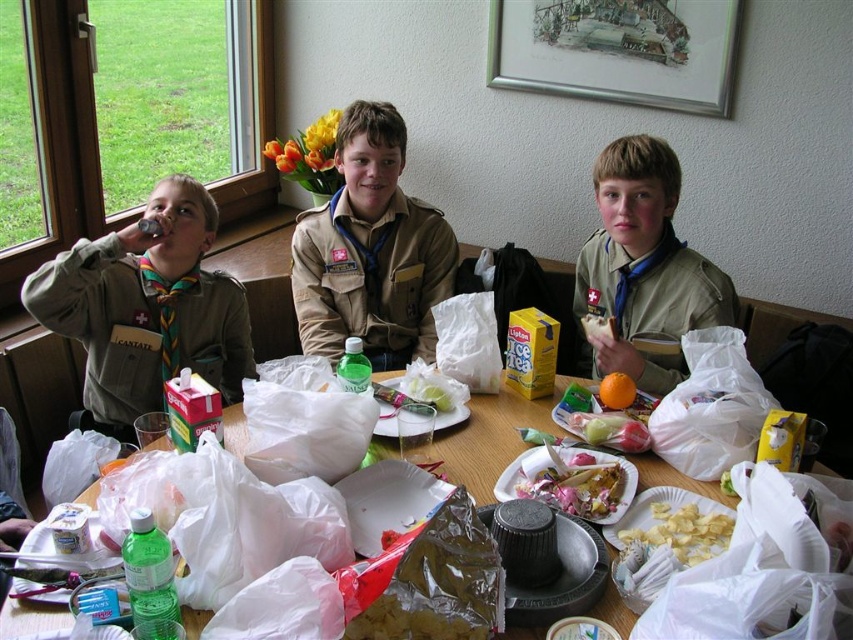
Question: Can you confirm if brown uniform at center is positioned below white plastic bags at center?

Choices:
 (A) yes
 (B) no

Answer: (B)

Question: Which point is farther to the camera?

Choices:
 (A) matte khaki uniform at center
 (B) white plastic bags at center
 (C) shiny metallic tray at center

Answer: (A)

Question: Is white plastic bags at center smaller than matte white chips at center?

Choices:
 (A) no
 (B) yes

Answer: (A)

Question: Which of these objects is positioned closest to the brown uniform at center?

Choices:
 (A) matte green uniform at left
 (B) matte white chips at center
 (C) shiny metallic tray at center

Answer: (A)

Question: Which point is closer to the camera taking this photo?

Choices:
 (A) (190, 332)
 (B) (624, 312)

Answer: (A)

Question: Can you confirm if matte khaki uniform at center is positioned below matte white chips at center?

Choices:
 (A) no
 (B) yes

Answer: (A)